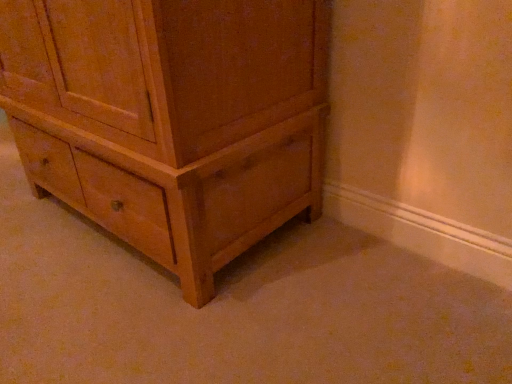
What is the approximate width of light brown wood chest of drawers at center?

61.13 centimeters.

Where is `light brown wood chest of drawers at center`? This screenshot has width=512, height=384. light brown wood chest of drawers at center is located at coordinates click(x=172, y=118).

This screenshot has height=384, width=512. What do you see at coordinates (172, 118) in the screenshot?
I see `light brown wood chest of drawers at center` at bounding box center [172, 118].

This screenshot has height=384, width=512. Find the location of `light brown wood chest of drawers at center`. light brown wood chest of drawers at center is located at coordinates (172, 118).